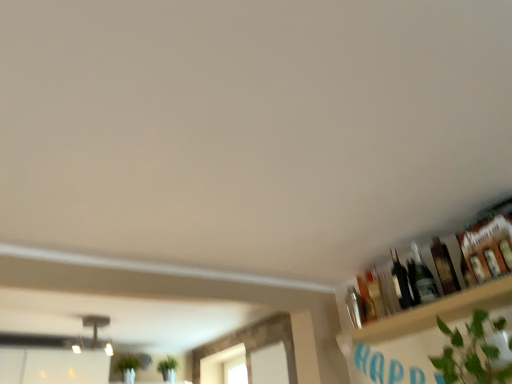
The width and height of the screenshot is (512, 384). Describe the element at coordinates (400, 282) in the screenshot. I see `shiny dark glass bottle at upper right, which is counted as the third bottle, starting from the right` at that location.

Locate an element on the screen. green leafy plant at lower right is located at coordinates (471, 353).

Image resolution: width=512 pixels, height=384 pixels. I want to click on translucent glass bottle at upper right, positioned as the 3th bottle in left-to-right order, so click(421, 279).

This screenshot has height=384, width=512. Identify the location of shiny dark glass bottle at upper right, which is counted as the third bottle, starting from the right. (400, 282).

Considering the sizes of objects metallic silver shaker at upper right, placed as the 4th bottle when sorted from right to left, and wooden shelf at upper right in the image provided, who is wider, metallic silver shaker at upper right, placed as the 4th bottle when sorted from right to left, or wooden shelf at upper right?

With larger width is wooden shelf at upper right.

How far apart are metallic silver shaker at upper right, placed as the 4th bottle when sorted from right to left, and wooden shelf at upper right?

metallic silver shaker at upper right, placed as the 4th bottle when sorted from right to left, is 12.46 inches from wooden shelf at upper right.

Which of these two, metallic silver shaker at upper right, the first bottle when ordered from left to right, or wooden shelf at upper right, stands taller?

metallic silver shaker at upper right, the first bottle when ordered from left to right, is taller.

Considering the relative sizes of metallic silver shaker at upper right, placed as the 4th bottle when sorted from right to left, and wooden shelf at upper right in the image provided, is metallic silver shaker at upper right, placed as the 4th bottle when sorted from right to left, smaller than wooden shelf at upper right?

Indeed, metallic silver shaker at upper right, placed as the 4th bottle when sorted from right to left, has a smaller size compared to wooden shelf at upper right.

Does green leafy plant at lower right contain translucent glass bottle at upper right, which ranks as the fourth bottle in left-to-right order?

Definitely not — translucent glass bottle at upper right, which ranks as the fourth bottle in left-to-right order, is not inside green leafy plant at lower right.

What's the angular difference between green leafy plant at lower right and translucent glass bottle at upper right, which ranks as the fourth bottle in left-to-right order,'s facing directions?

green leafy plant at lower right and translucent glass bottle at upper right, which ranks as the fourth bottle in left-to-right order, are facing 0.00135 degrees away from each other.

Considering the sizes of green leafy plant at lower right and translucent glass bottle at upper right, which ranks as the first bottle in right-to-left order, in the image, is green leafy plant at lower right taller or shorter than translucent glass bottle at upper right, which ranks as the first bottle in right-to-left order,?

Clearly, green leafy plant at lower right is taller compared to translucent glass bottle at upper right, which ranks as the first bottle in right-to-left order.

Is green leafy plant at lower right further to the viewer compared to translucent glass bottle at upper right, which ranks as the fourth bottle in left-to-right order?

No, it is not.

Looking at this image, is translucent glass bottle at upper right, positioned as the 3th bottle in left-to-right order, at the back of wooden shelf at upper right?

That's not correct — wooden shelf at upper right is not looking away from translucent glass bottle at upper right, positioned as the 3th bottle in left-to-right order.

Does wooden shelf at upper right come in front of translucent glass bottle at upper right, acting as the 2th bottle starting from the right?

Yes.

Does wooden shelf at upper right touch translucent glass bottle at upper right, positioned as the 3th bottle in left-to-right order?

No, wooden shelf at upper right is not next to translucent glass bottle at upper right, positioned as the 3th bottle in left-to-right order.

Between point (339, 334) and point (417, 294), which one is positioned behind?

Positioned behind is point (339, 334).

Is wooden shelf at upper right touching green leafy plant at lower right?

No, wooden shelf at upper right is not beside green leafy plant at lower right.

Is wooden shelf at upper right bigger or smaller than green leafy plant at lower right?

wooden shelf at upper right is smaller than green leafy plant at lower right.

From the image's perspective, is wooden shelf at upper right on green leafy plant at lower right?

Yes, from the image's perspective, wooden shelf at upper right is on top of green leafy plant at lower right.

Locate an element on the screen. The height and width of the screenshot is (384, 512). the 2nd bottle located above the translucent glass bottle at upper right, which ranks as the fourth bottle in left-to-right order (from a real-world perspective) is located at coordinates (400, 282).

From a real-world perspective, which is physically below, shiny dark glass bottle at upper right, positioned as the 2th bottle in left-to-right order, or translucent glass bottle at upper right, which ranks as the fourth bottle in left-to-right order?

From a 3D spatial view, translucent glass bottle at upper right, which ranks as the fourth bottle in left-to-right order, is below.

Are shiny dark glass bottle at upper right, positioned as the 2th bottle in left-to-right order, and translucent glass bottle at upper right, which ranks as the fourth bottle in left-to-right order, making contact?

No, shiny dark glass bottle at upper right, positioned as the 2th bottle in left-to-right order, is not touching translucent glass bottle at upper right, which ranks as the fourth bottle in left-to-right order.

In the scene shown: From the image's perspective, relative to wooden shelf at upper right, is translucent glass bottle at upper right, which ranks as the first bottle in right-to-left order, above or below?

From the image's perspective, translucent glass bottle at upper right, which ranks as the first bottle in right-to-left order, appears above wooden shelf at upper right.

Identify the location of shelf lying in front of the translucent glass bottle at upper right, which ranks as the first bottle in right-to-left order. (432, 313).

Based on the photo, considering the sizes of translucent glass bottle at upper right, which ranks as the fourth bottle in left-to-right order, and wooden shelf at upper right in the image, is translucent glass bottle at upper right, which ranks as the fourth bottle in left-to-right order, wider or thinner than wooden shelf at upper right?

translucent glass bottle at upper right, which ranks as the fourth bottle in left-to-right order, is thinner than wooden shelf at upper right.

Identify the location of bottle that is the 1st one when counting leftward from the translucent glass bottle at upper right, which ranks as the first bottle in right-to-left order. (421, 279).

Which of these two, translucent glass bottle at upper right, acting as the 2th bottle starting from the right, or translucent glass bottle at upper right, which ranks as the fourth bottle in left-to-right order, stands taller?

Standing taller between the two is translucent glass bottle at upper right, acting as the 2th bottle starting from the right.

From a real-world perspective, who is located higher, translucent glass bottle at upper right, acting as the 2th bottle starting from the right, or translucent glass bottle at upper right, which ranks as the first bottle in right-to-left order?

Result: In real-world perspective, translucent glass bottle at upper right, acting as the 2th bottle starting from the right, is above.

Considering the relative sizes of translucent glass bottle at upper right, positioned as the 3th bottle in left-to-right order, and translucent glass bottle at upper right, which ranks as the first bottle in right-to-left order, in the image provided, is translucent glass bottle at upper right, positioned as the 3th bottle in left-to-right order, wider than translucent glass bottle at upper right, which ranks as the first bottle in right-to-left order,?

No.

I want to click on shelf on the right of metallic silver shaker at upper right, the first bottle when ordered from left to right, so click(x=432, y=313).

Find the location of a particular element. This screenshot has width=512, height=384. houseplant below the translucent glass bottle at upper right, which ranks as the fourth bottle in left-to-right order (from the image's perspective) is located at coordinates coord(471,353).

Estimate the real-world distances between objects in this image. Which object is closer to shiny dark glass bottle at upper right, positioned as the 2th bottle in left-to-right order, wooden shelf at upper right or translucent glass bottle at upper right, which ranks as the first bottle in right-to-left order?

Based on the image, translucent glass bottle at upper right, which ranks as the first bottle in right-to-left order, appears to be nearer to shiny dark glass bottle at upper right, positioned as the 2th bottle in left-to-right order.

Looking at this image, based on their spatial positions, is translucent glass bottle at upper right, which ranks as the fourth bottle in left-to-right order, or metallic silver shaker at upper right, placed as the 4th bottle when sorted from right to left, closer to translucent glass bottle at upper right, acting as the 2th bottle starting from the right?

Based on the image, translucent glass bottle at upper right, which ranks as the fourth bottle in left-to-right order, appears to be nearer to translucent glass bottle at upper right, acting as the 2th bottle starting from the right.

Looking at the image, which one is located further to green leafy plant at lower right, shiny dark glass bottle at upper right, positioned as the 2th bottle in left-to-right order, or wooden shelf at upper right?

The object further to green leafy plant at lower right is shiny dark glass bottle at upper right, positioned as the 2th bottle in left-to-right order.

Based on the photo, based on their spatial positions, is metallic silver shaker at upper right, the first bottle when ordered from left to right, or translucent glass bottle at upper right, which ranks as the fourth bottle in left-to-right order, further from wooden shelf at upper right?

Among the two, metallic silver shaker at upper right, the first bottle when ordered from left to right, is located further to wooden shelf at upper right.

From the image, which object appears to be farther from shiny dark glass bottle at upper right, which is counted as the third bottle, starting from the right, metallic silver shaker at upper right, the first bottle when ordered from left to right, or translucent glass bottle at upper right, which ranks as the first bottle in right-to-left order?

The object further to shiny dark glass bottle at upper right, which is counted as the third bottle, starting from the right, is metallic silver shaker at upper right, the first bottle when ordered from left to right.

From the image, which object appears to be farther from shiny dark glass bottle at upper right, positioned as the 2th bottle in left-to-right order, wooden shelf at upper right or translucent glass bottle at upper right, acting as the 2th bottle starting from the right?

wooden shelf at upper right.

Estimate the real-world distances between objects in this image. Which object is closer to shiny dark glass bottle at upper right, positioned as the 2th bottle in left-to-right order, translucent glass bottle at upper right, which ranks as the first bottle in right-to-left order, or metallic silver shaker at upper right, placed as the 4th bottle when sorted from right to left?

Based on the image, translucent glass bottle at upper right, which ranks as the first bottle in right-to-left order, appears to be nearer to shiny dark glass bottle at upper right, positioned as the 2th bottle in left-to-right order.

Based on their spatial positions, is shiny dark glass bottle at upper right, which is counted as the third bottle, starting from the right, or green leafy plant at lower right further from translucent glass bottle at upper right, positioned as the 3th bottle in left-to-right order?

The object further to translucent glass bottle at upper right, positioned as the 3th bottle in left-to-right order, is green leafy plant at lower right.

Identify the location of shelf between green leafy plant at lower right and shiny dark glass bottle at upper right, which is counted as the third bottle, starting from the right, in the front-back direction. Image resolution: width=512 pixels, height=384 pixels. (432, 313).

The height and width of the screenshot is (384, 512). What are the coordinates of `bottle between wooden shelf at upper right and translucent glass bottle at upper right, positioned as the 3th bottle in left-to-right order, from front to back` in the screenshot? It's located at (444, 267).

At what (x,y) coordinates should I click in order to perform the action: click on shelf positioned between green leafy plant at lower right and translucent glass bottle at upper right, positioned as the 3th bottle in left-to-right order, from near to far. Please return your answer as a coordinate pair (x, y). The height and width of the screenshot is (384, 512). Looking at the image, I should click on (432, 313).

Where is `bottle between green leafy plant at lower right and translucent glass bottle at upper right, positioned as the 3th bottle in left-to-right order, in the front-back direction`? bottle between green leafy plant at lower right and translucent glass bottle at upper right, positioned as the 3th bottle in left-to-right order, in the front-back direction is located at coordinates (444, 267).